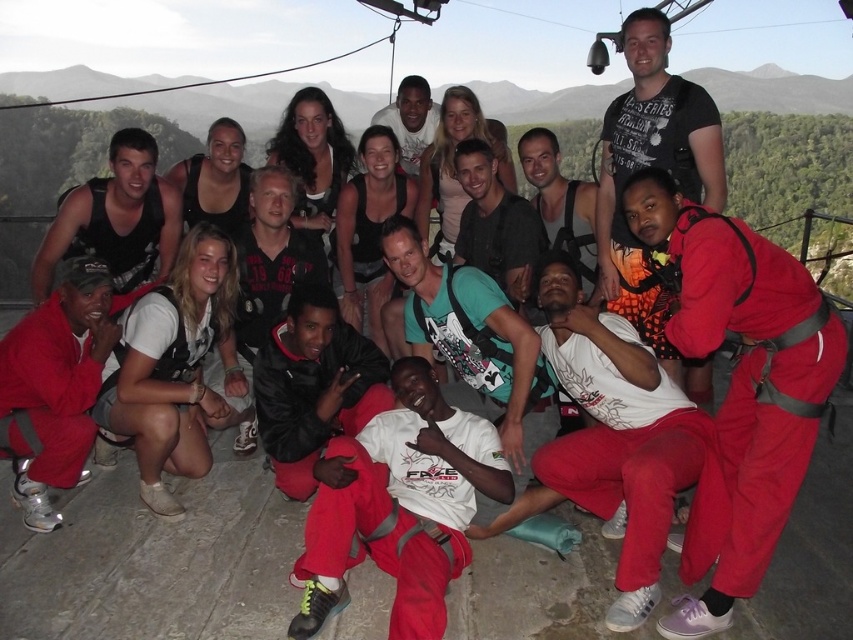
Can you confirm if white matte t-shirt at center is positioned to the right of white matte t-shirt at lower center?

Indeed, white matte t-shirt at center is positioned on the right side of white matte t-shirt at lower center.

Does white matte t-shirt at center have a smaller size compared to white matte t-shirt at lower center?

Yes.

Is point (380, 454) behind point (202, 416)?

No, (380, 454) is closer to viewer.

At what (x,y) coordinates should I click in order to perform the action: click on white matte t-shirt at center. Please return your answer as a coordinate pair (x, y). Looking at the image, I should click on (399, 504).

Is white matte t-shirt at center below matte black t-shirt at upper right?

Correct, white matte t-shirt at center is located below matte black t-shirt at upper right.

Can you confirm if white matte t-shirt at center is positioned to the left of matte black t-shirt at upper right?

Indeed, white matte t-shirt at center is positioned on the left side of matte black t-shirt at upper right.

Describe the element at coordinates (399, 504) in the screenshot. I see `white matte t-shirt at center` at that location.

You are a GUI agent. You are given a task and a screenshot of the screen. Output one action in this format:
    pyautogui.click(x=<x>, y=<y>)
    Task: Click on the white matte t-shirt at center
    This screenshot has height=640, width=853.
    Given the screenshot: What is the action you would take?
    pyautogui.click(x=399, y=504)

Between point (199, 424) and point (643, 328), which one is positioned behind?

The point (643, 328) is behind.

Who is lower down, white matte t-shirt at lower center or matte black t-shirt at upper right?

white matte t-shirt at lower center is lower down.

Who is more distant from viewer, (187,428) or (627,164)?

The point (627,164) is behind.

Find the location of `white matte t-shirt at lower center`. white matte t-shirt at lower center is located at coordinates tap(173, 365).